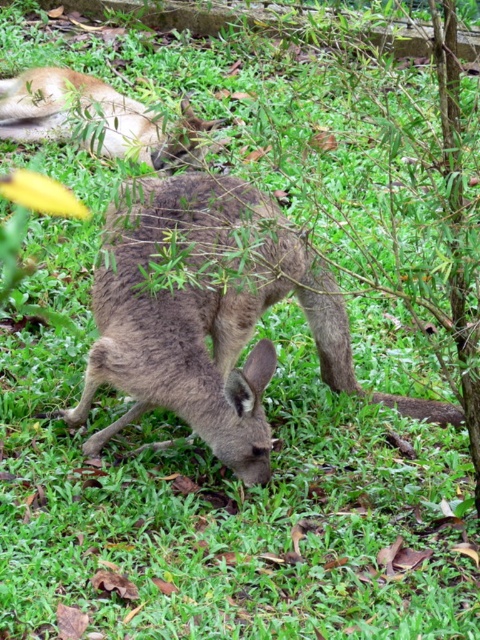
Question: Among these objects, which one is nearest to the camera?

Choices:
 (A) brown fur kangaroo at upper left
 (B) brown fur kangaroo at center

Answer: (B)

Question: Considering the relative positions of brown fur kangaroo at center and brown fur kangaroo at upper left in the image provided, where is brown fur kangaroo at center located with respect to brown fur kangaroo at upper left?

Choices:
 (A) right
 (B) left

Answer: (A)

Question: Which of the following is the closest to the observer?

Choices:
 (A) (93, 109)
 (B) (99, 268)

Answer: (B)

Question: Does brown fur kangaroo at center have a greater width compared to brown fur kangaroo at upper left?

Choices:
 (A) no
 (B) yes

Answer: (B)

Question: Is brown fur kangaroo at center smaller than brown fur kangaroo at upper left?

Choices:
 (A) no
 (B) yes

Answer: (B)